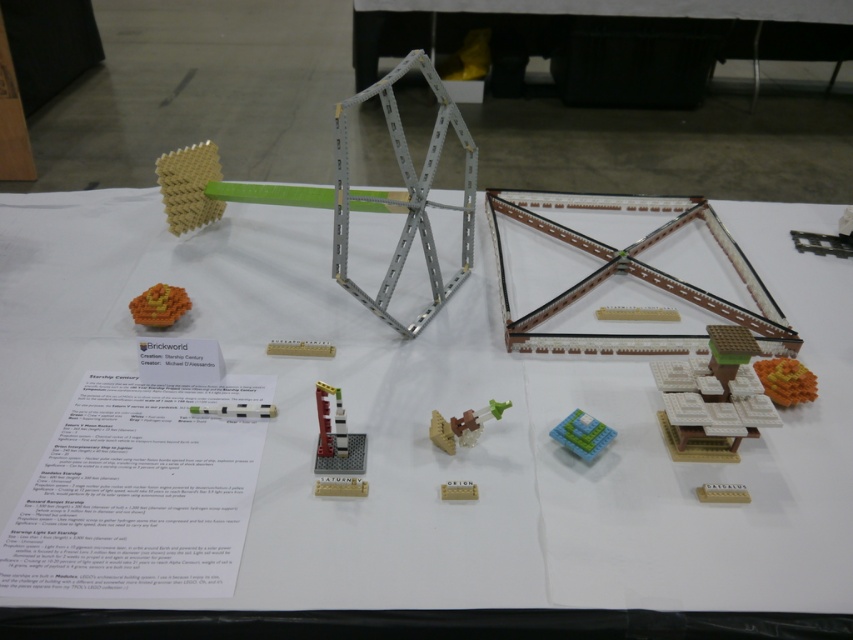
You are a LEGO enthusiast who wants to place a new LEGO model between the brick red metallic satellite at center and another LEGO model. If the new model requires 1 meter of space, will there be enough room between them?

The brick red metallic satellite at center and the other LEGO model are 98.40 centimeters apart. Since the required space is 1 meter, which is 100 centimeters, there is not enough space to place the new model between them.

You are standing at the edge of the table where the LEGO display is placed. You see the orange matte cube at center located at point [160,305]. If you want to reach this cube without moving any other LEGO models, which direction should you move towards?

The orange matte cube at center is located at point [160,305]. Since you are at the edge of the table, you should move towards the center of the table to reach it without disturbing other models.